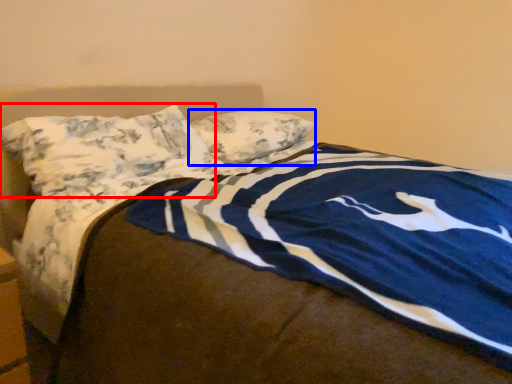
Question: Which object appears closest to the camera in this image, pillow (highlighted by a red box) or pillow (highlighted by a blue box)?

Choices:
 (A) pillow
 (B) pillow

Answer: (A)